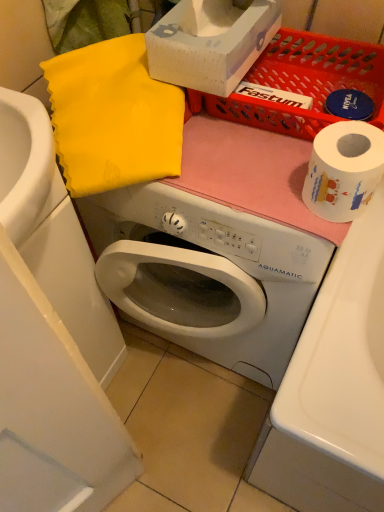
Question: Does white paper at right appear on the left side of white cardboard box at upper center?

Choices:
 (A) no
 (B) yes

Answer: (A)

Question: Does white paper at right turn towards white cardboard box at upper center?

Choices:
 (A) no
 (B) yes

Answer: (A)

Question: Would you say white paper at right contains white cardboard box at upper center?

Choices:
 (A) yes
 (B) no

Answer: (B)

Question: Can you confirm if white paper at right is shorter than white cardboard box at upper center?

Choices:
 (A) yes
 (B) no

Answer: (A)

Question: From the image's perspective, is white paper at right below white cardboard box at upper center?

Choices:
 (A) no
 (B) yes

Answer: (B)

Question: Is point (334, 148) closer or farther from the camera than point (246, 57)?

Choices:
 (A) farther
 (B) closer

Answer: (B)

Question: Considering the positions of white paper at right and white cardboard box at upper center in the image, is white paper at right taller or shorter than white cardboard box at upper center?

Choices:
 (A) short
 (B) tall

Answer: (A)

Question: Is white paper at right bigger or smaller than white cardboard box at upper center?

Choices:
 (A) small
 (B) big

Answer: (A)

Question: From the image's perspective, relative to white cardboard box at upper center, is white paper at right above or below?

Choices:
 (A) above
 (B) below

Answer: (B)

Question: From a real-world perspective, is white cardboard box at upper center physically located above or below white paper at right?

Choices:
 (A) above
 (B) below

Answer: (A)

Question: Visually, is white cardboard box at upper center positioned to the left or to the right of white paper at right?

Choices:
 (A) right
 (B) left

Answer: (B)

Question: Is white cardboard box at upper center situated inside white paper at right or outside?

Choices:
 (A) inside
 (B) outside

Answer: (B)

Question: Considering their positions, is white cardboard box at upper center located in front of or behind white paper at right?

Choices:
 (A) behind
 (B) front

Answer: (A)

Question: Is white glossy sink at lower left spatially inside white paper at right, or outside of it?

Choices:
 (A) outside
 (B) inside

Answer: (A)

Question: Is point (87, 305) closer or farther from the camera than point (327, 177)?

Choices:
 (A) farther
 (B) closer

Answer: (A)